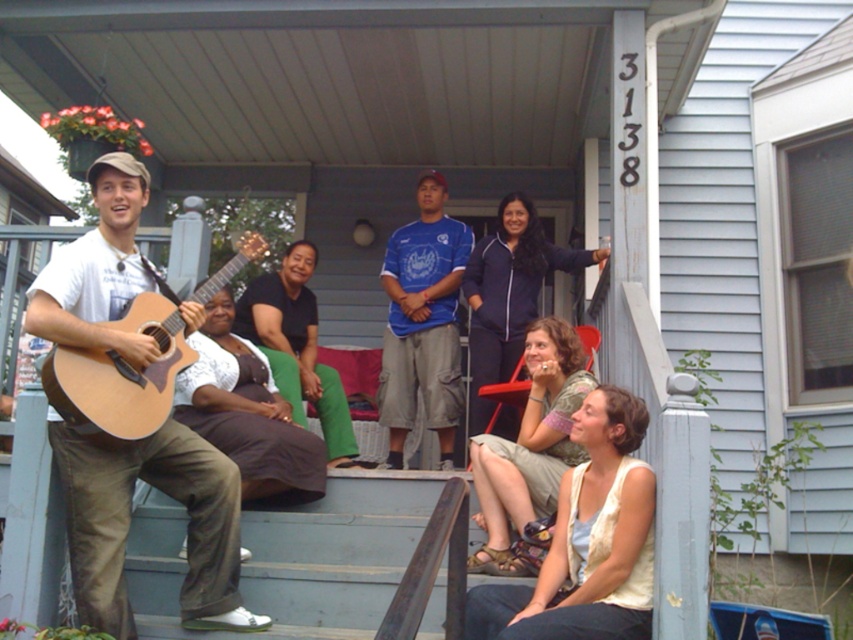
You are standing at the point marked as point (296, 557). What is the object located exactly at your current position?

The wooden porch at center is located exactly at point (296, 557).

You are trying to move a 1.2 meter wide plant stand from the wooden porch at center to the light beige vest at lower right. Is there enough space to move it sideways without tilting?

The wooden porch at center might be wider than light beige vest at lower right, so there may not be enough space to move the plant stand sideways without tilting. Check the width difference first.

You are organizing a small concert on the porch and need to place a 1.2 meter wide amplifier next to the light brown acoustic guitar at lower left and the black matte shirt at center. Based on their widths, will the amplifier fit between them without overlapping?

The light brown acoustic guitar at lower left is narrower than the black matte shirt at center. Since the amplifier is 1.2 meters wide, it depends on the combined width of both objects. However, without knowing their exact widths, we can only state the comparison between them. The question cannot be definitively answered with the provided information.